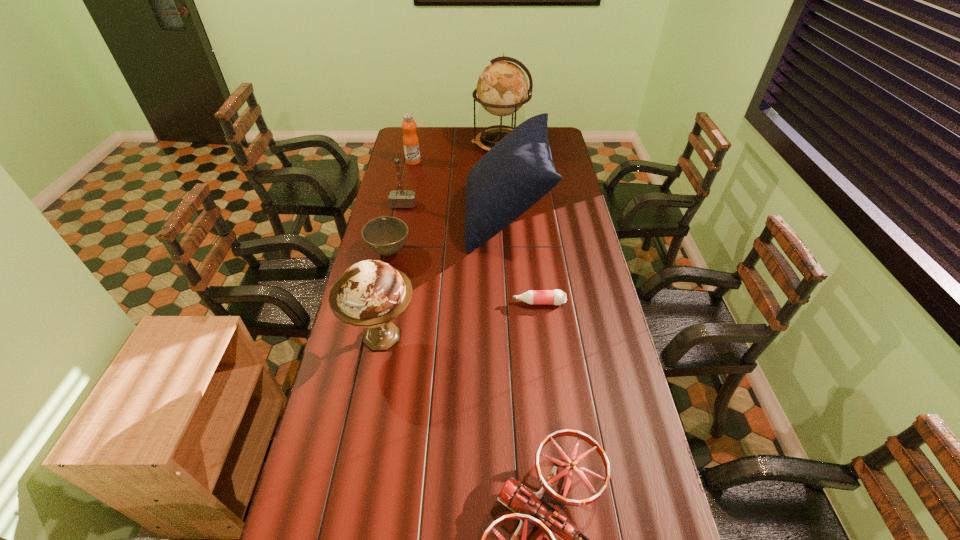
Where is `free region located 0.340m with the cap open on the bottle`? The width and height of the screenshot is (960, 540). free region located 0.340m with the cap open on the bottle is located at coordinates (417, 303).

The height and width of the screenshot is (540, 960). What are the coordinates of `vacant space located 0.290m with the cap open on the bottle` in the screenshot? It's located at click(x=431, y=303).

The image size is (960, 540). I want to click on vacant space located with the cap open on the bottle, so click(x=400, y=303).

I want to click on object situated at the far edge, so coord(502,88).

What are the coordinates of `globe present at the left edge` in the screenshot? It's located at (371, 293).

Where is `fruit juice at the left edge`? This screenshot has height=540, width=960. fruit juice at the left edge is located at coordinates (410, 139).

Identify the location of hammer present at the left edge. The image size is (960, 540). (400, 198).

What are the coordinates of `bowl positioned at the left edge` in the screenshot? It's located at (385, 235).

You are a GUI agent. You are given a task and a screenshot of the screen. Output one action in this format:
    pyautogui.click(x=<x>, y=<y>)
    Task: Click on the object at the right edge
    The image size is (960, 540).
    Given the screenshot: What is the action you would take?
    pyautogui.click(x=534, y=297)

Where is `free region at the left edge`? free region at the left edge is located at coordinates (322, 482).